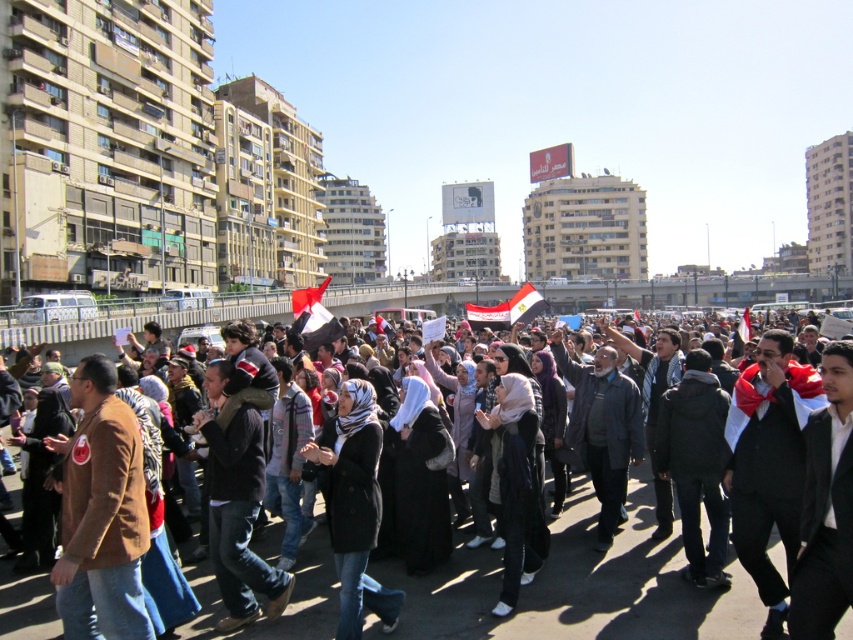
You are a photographer trying to capture a clear shot of both the white fabric scarf at center and the dark brown leather jacket at center in the crowd. Since you want to ensure both are visible, which object should you focus on first considering their sizes?

The white fabric scarf at center is larger in size than the dark brown leather jacket at center, so you should focus on capturing the white fabric scarf at center first as it is bigger and more prominent in the frame.

You are a photographer trying to capture a clear shot of the white fabric scarf at center and the dark gray coat at center from a distance. Based on their sizes, which object would appear wider in your photo?

The white fabric scarf at center might appear wider in the photo than the dark gray coat at center since it is wider according to the description.

You are a photographer standing at the edge of the crowd capturing the protest scene. You notice two points in the image labeled as point 1 at coordinates point 1 at point (844, 461) and point 2 at point (660, 332). Which point is closer to your camera lens?

Point 1 at point (844, 461) is closer to the camera lens than point 2 at point (660, 332).